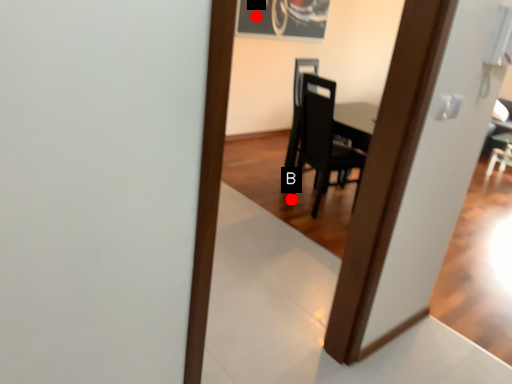
Question: Two points are circled on the image, labeled by A and B beside each circle. Which point is closer to the camera?

Choices:
 (A) A is closer
 (B) B is closer

Answer: (B)